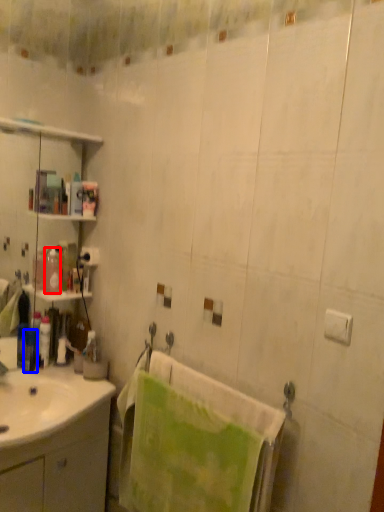
Question: Among these objects, which one is farthest to the camera, toiletry (highlighted by a red box) or toiletry (highlighted by a blue box)?

Choices:
 (A) toiletry
 (B) toiletry

Answer: (B)